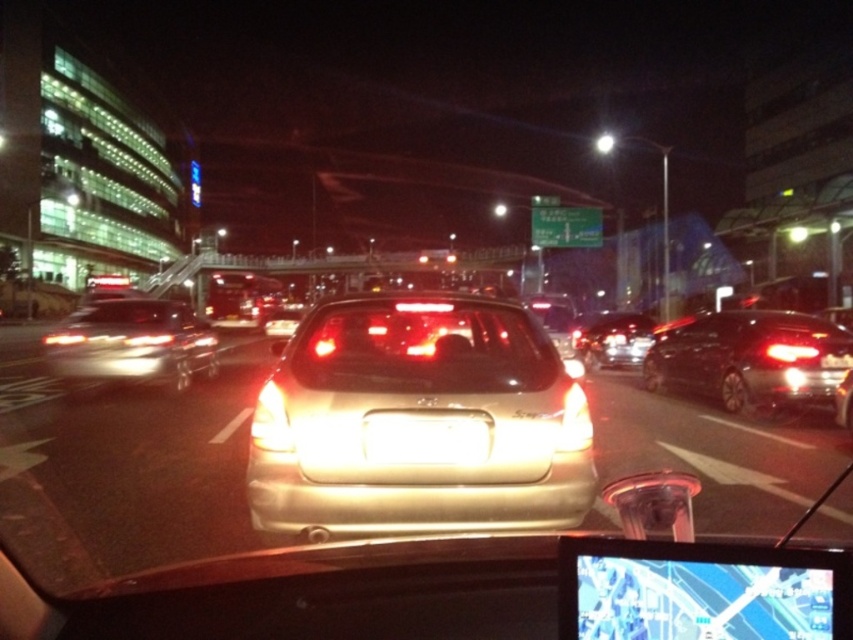
Question: Estimate the real-world distances between objects in this image. Which object is farther from the shiny silver sedan at left?

Choices:
 (A) transparent glass windshield at center
 (B) shiny silver sedan at center
 (C) glossy black sedan at right
 (D) satin gold sedan at center

Answer: (B)

Question: Does transparent glass windshield at center appear under shiny silver sedan at center?

Choices:
 (A) no
 (B) yes

Answer: (A)

Question: Is satin gold sedan at center bigger than glossy black sedan at right?

Choices:
 (A) no
 (B) yes

Answer: (B)

Question: Considering the relative positions of satin gold sedan at center and glossy black sedan at right in the image provided, where is satin gold sedan at center located with respect to glossy black sedan at right?

Choices:
 (A) below
 (B) above

Answer: (B)

Question: Which point appears closest to the camera in this image?

Choices:
 (A) (648, 320)
 (B) (527, 522)

Answer: (B)

Question: Which object is positioned farthest from the transparent glass windshield at center?

Choices:
 (A) shiny silver sedan at center
 (B) shiny silver sedan at left
 (C) glossy black sedan at right

Answer: (B)